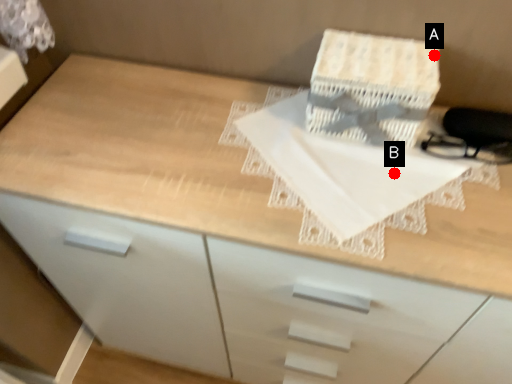
Question: Two points are circled on the image, labeled by A and B beside each circle. Which point is farther to the camera?

Choices:
 (A) A is further
 (B) B is further

Answer: (A)